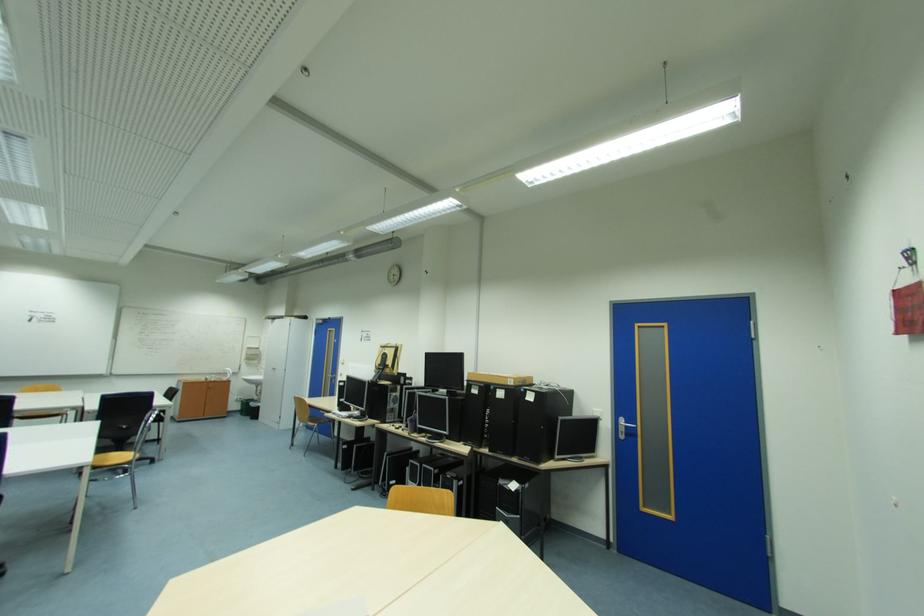
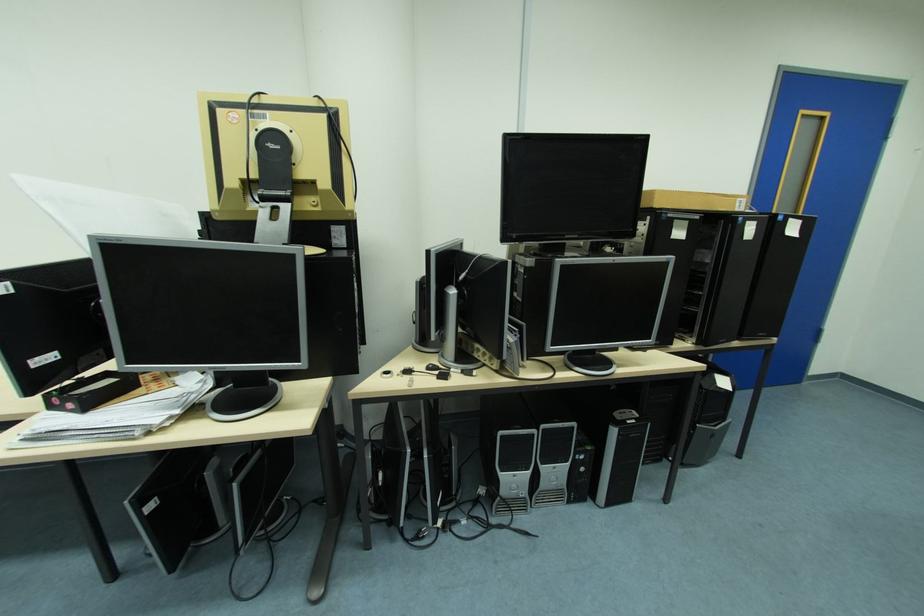
In the second image, find the point that corresponds to pixel 418 461 in the first image.

(507, 434)